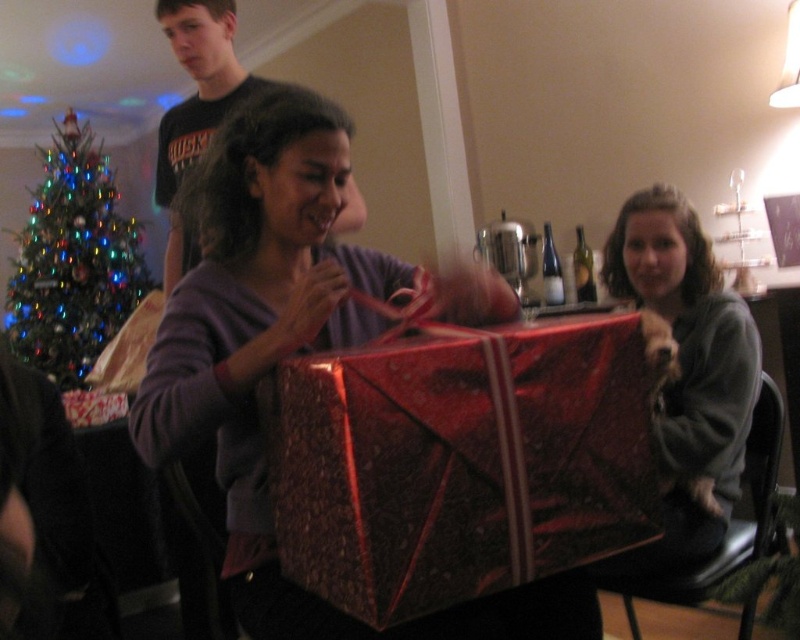
Question: Does matte purple sweater at center appear under green glittering christmas tree at left?

Choices:
 (A) yes
 (B) no

Answer: (A)

Question: Is matte purple sweater at center below gray fleece sweater at right?

Choices:
 (A) yes
 (B) no

Answer: (B)

Question: Which point is closer to the camera?

Choices:
 (A) shiny red wrapping paper at center
 (B) matte purple sweater at center
 (C) green glittering christmas tree at left
 (D) gray fleece sweater at right

Answer: (A)

Question: Considering the relative positions of shiny red wrapping paper at center and matte black t-shirt at upper left in the image provided, where is shiny red wrapping paper at center located with respect to matte black t-shirt at upper left?

Choices:
 (A) above
 (B) below

Answer: (B)

Question: Based on their relative distances, which object is nearer to the green glittering christmas tree at left?

Choices:
 (A) shiny red wrapping paper at center
 (B) gray fleece sweater at right
 (C) matte purple sweater at center
 (D) matte black t-shirt at upper left

Answer: (D)

Question: Which is nearer to the matte purple sweater at center?

Choices:
 (A) matte black t-shirt at upper left
 (B) gray fleece sweater at right
 (C) shiny red wrapping paper at center
 (D) green glittering christmas tree at left

Answer: (C)